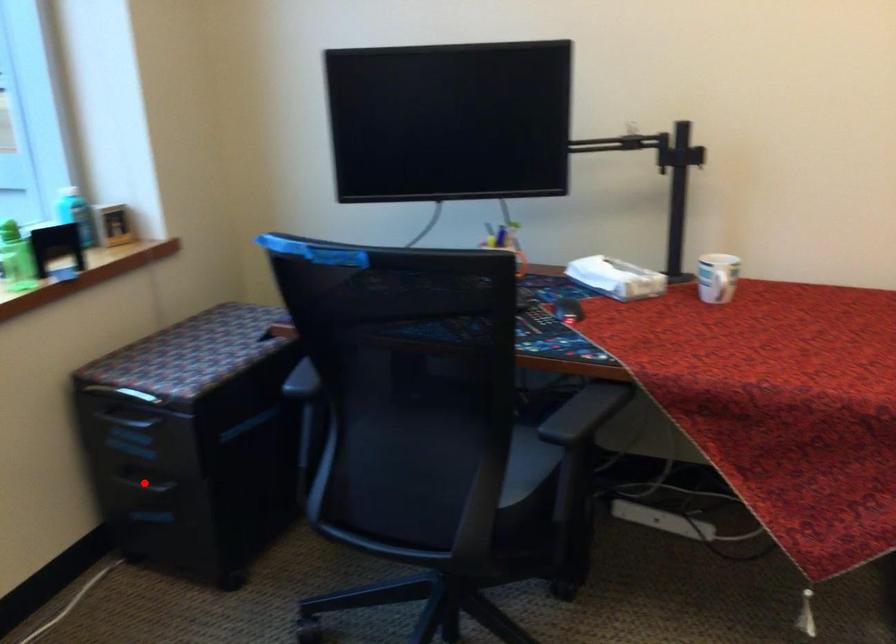
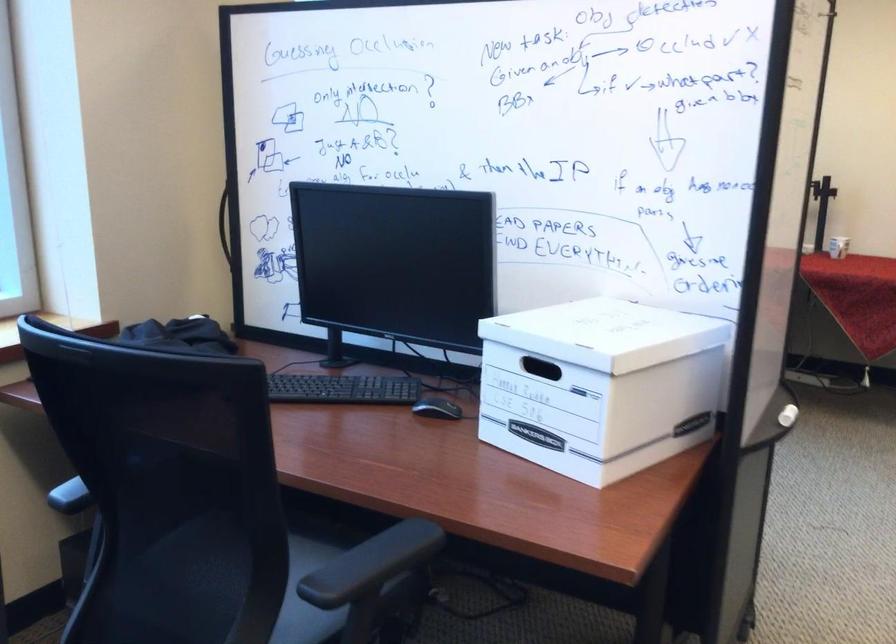
Question: I am providing you with two images of the same scene from different viewpoints. A red point is marked on the first image. Is the red point's position out of view in image 2?

Choices:
 (A) Yes
 (B) No

Answer: (A)